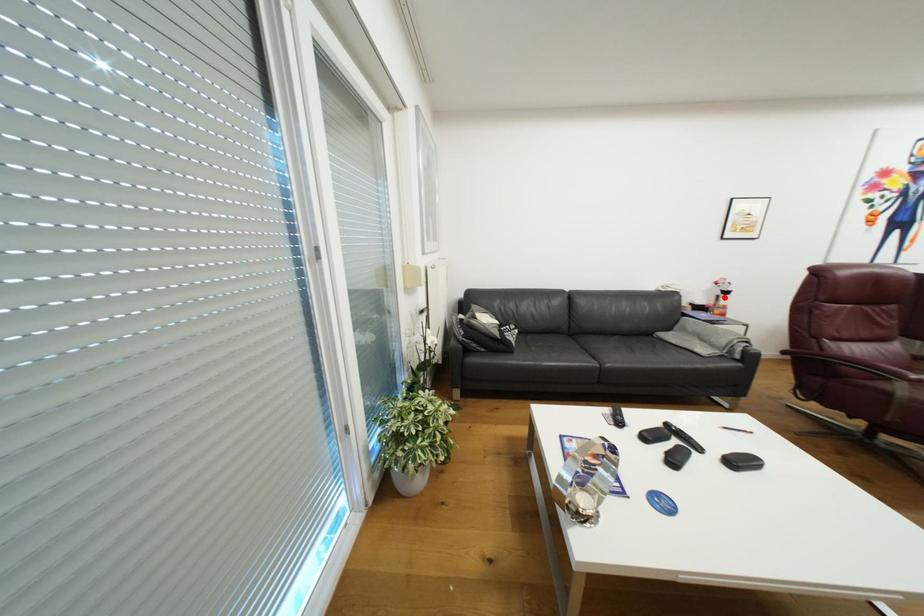
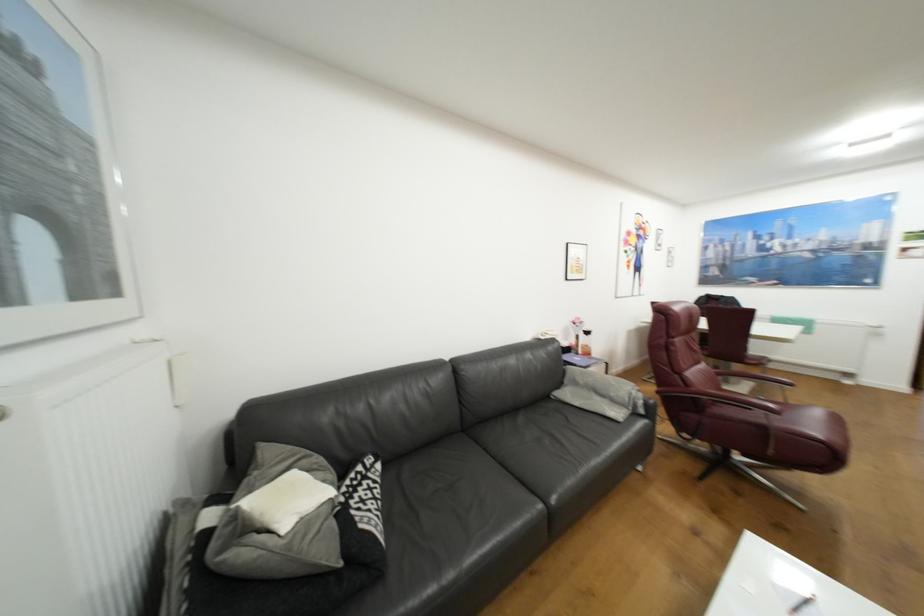
Locate, in the second image, the point that corresponds to the highlighted location in the first image.

(584, 336)